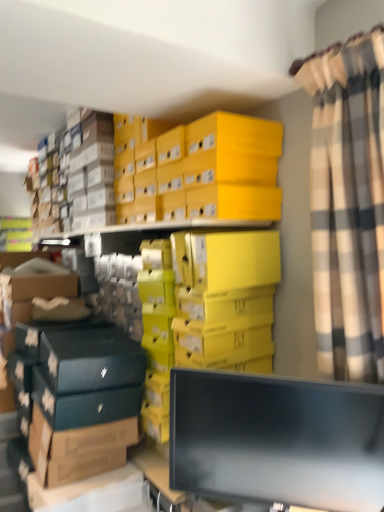
Question: Considering the positions of point (218, 159) and point (190, 451), is point (218, 159) closer or farther from the camera than point (190, 451)?

Choices:
 (A) closer
 (B) farther

Answer: (B)

Question: From their relative heights in the image, would you say yellow cardboard box at upper center is taller or shorter than black glossy monitor at lower center?

Choices:
 (A) short
 (B) tall

Answer: (A)

Question: Which is farther from the plaid fabric curtain at right?

Choices:
 (A) yellow cardboard box at upper center
 (B) black glossy monitor at lower center

Answer: (A)

Question: Which of these objects is positioned closest to the plaid fabric curtain at right?

Choices:
 (A) yellow cardboard box at upper center
 (B) black glossy monitor at lower center

Answer: (B)